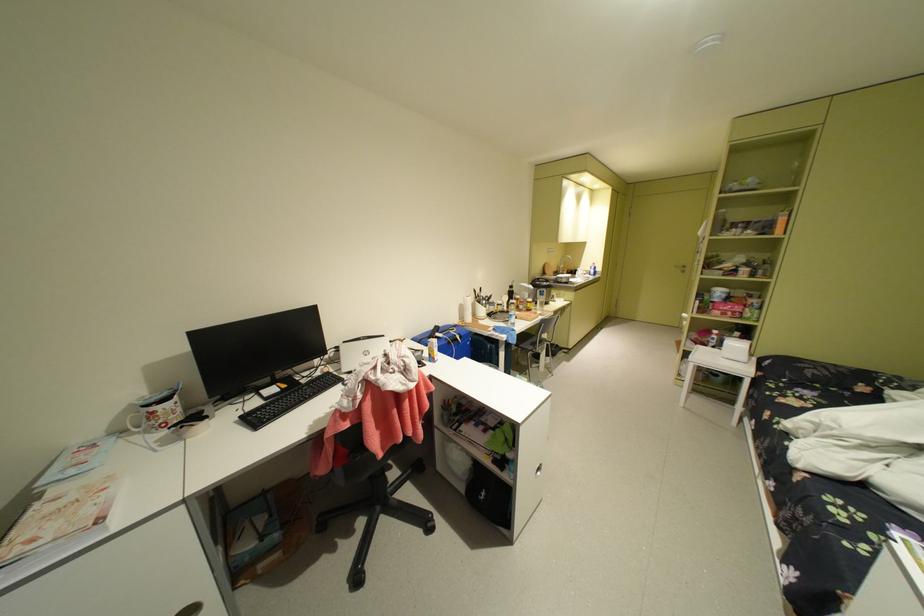
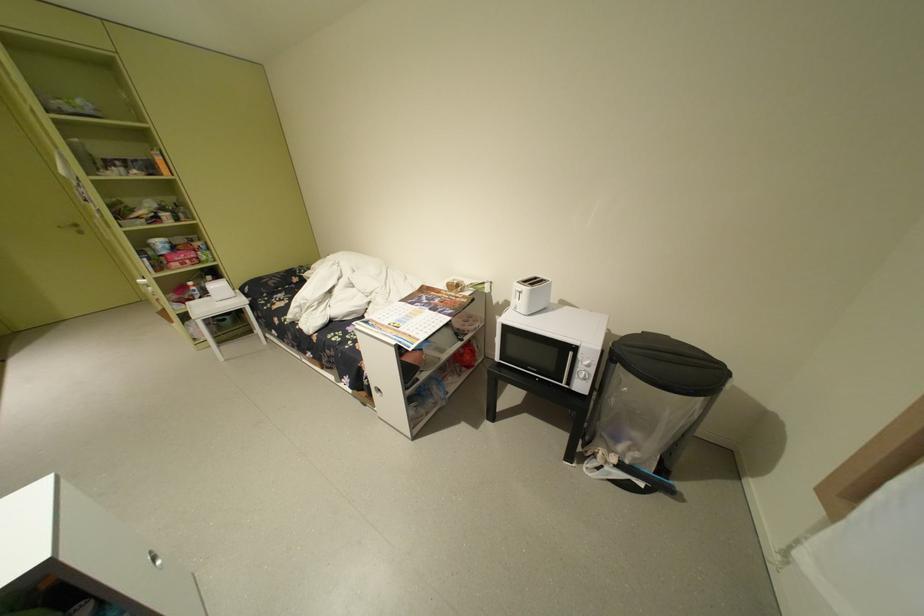
Where in the second image is the point corresponding to point 727,334 from the first image?

(204, 286)